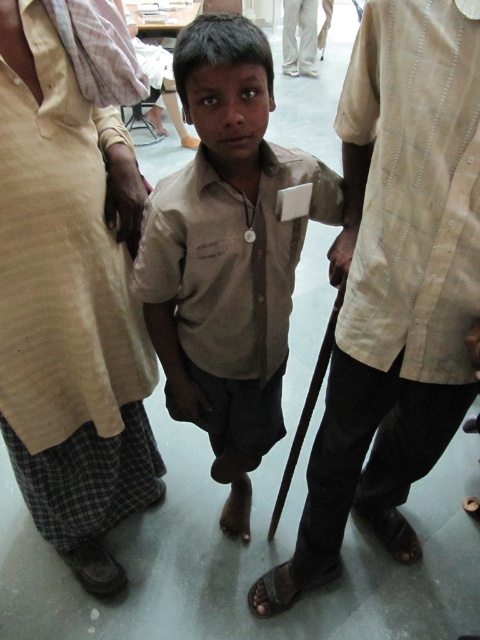
You are a photographer adjusting your camera settings. You notice two shirts in the scene, the beige textured shirt at center and the matte khaki shirt at center. Which shirt is positioned to the right side of the other?

→ The beige textured shirt at center is positioned to the right of the matte khaki shirt at center according to the description.

You are a fashion designer observing a scene where a beige cotton shirt at left and a matte khaki shirt at center are displayed. Which shirt has a larger size?

The matte khaki shirt at center is larger than the beige cotton shirt at left.

You are a photographer trying to focus on the matte khaki shirt at center. Given that your camera has a focal length of 50mm and the shirt is at position coordinates of point 0.398, 0.473, can you estimate whether the shirt is within the standard camera frame? Please explain your reasoning based on the coordinates provided.

The matte khaki shirt at center is positioned at coordinates point (227,253). In standard camera framing, coordinates typically range from 0 to 1, where (240,320) is the exact center. Since 0.398 is slightly left of center horizontally and 0.473 is slightly below center vertically, the shirt is within the standard frame as it lies near the center area.